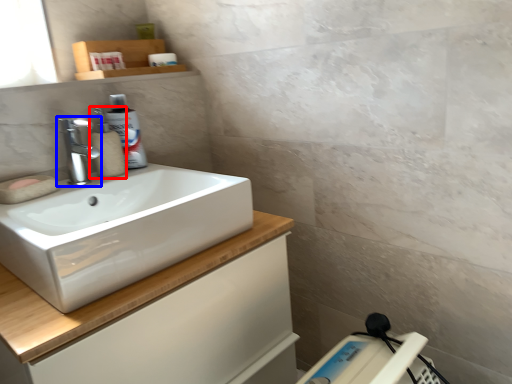
Question: Which point is further to the camera, soap dispenser (highlighted by a red box) or tap (highlighted by a blue box)?

Choices:
 (A) soap dispenser
 (B) tap

Answer: (A)